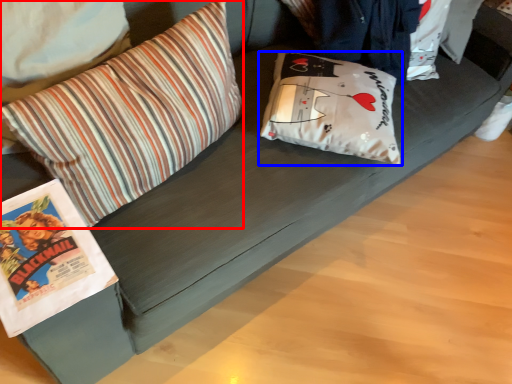
Question: Which point is further to the camera, pillow (highlighted by a red box) or pillow (highlighted by a blue box)?

Choices:
 (A) pillow
 (B) pillow

Answer: (B)